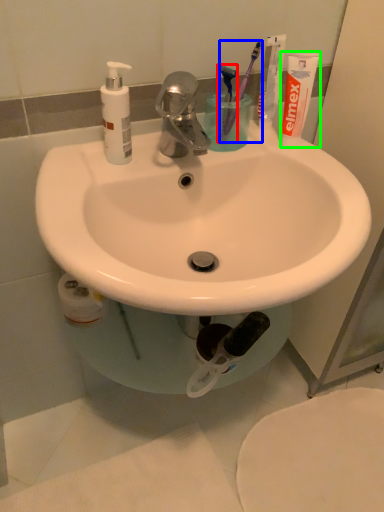
Question: Which is nearer to the toothbrush (highlighted by a red box)? toothbrush (highlighted by a blue box) or toothpaste (highlighted by a green box).

Choices:
 (A) toothbrush
 (B) toothpaste

Answer: (A)